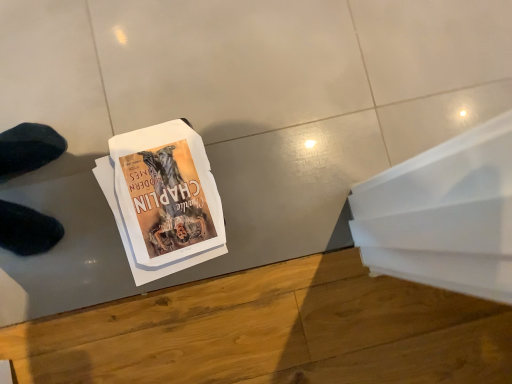
The image size is (512, 384). Find the location of `vacant space situated on the left part of matte paper book at center`. vacant space situated on the left part of matte paper book at center is located at coordinates (65, 151).